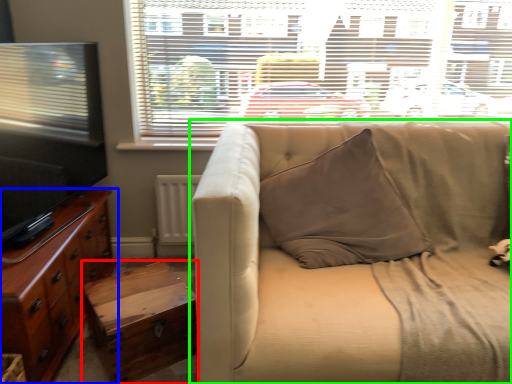
Question: Which object is the farthest from table (highlighted by a red box)? Choose among these: cabinetry (highlighted by a blue box) or studio couch (highlighted by a green box).

Choices:
 (A) cabinetry
 (B) studio couch

Answer: (B)